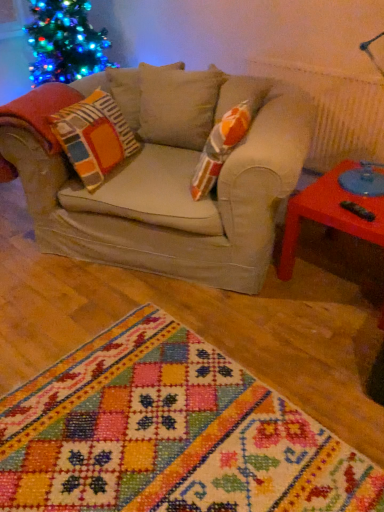
Question: Is rubberized plastic table at right in front of or behind multicolored woven rug at center in the image?

Choices:
 (A) front
 (B) behind

Answer: (B)

Question: Considering the positions of rubberized plastic table at right and multicolored woven rug at center in the image, is rubberized plastic table at right bigger or smaller than multicolored woven rug at center?

Choices:
 (A) big
 (B) small

Answer: (B)

Question: Is rubberized plastic table at right wider or thinner than multicolored woven rug at center?

Choices:
 (A) thin
 (B) wide

Answer: (A)

Question: In terms of width, does multicolored woven rug at center look wider or thinner when compared to rubberized plastic table at right?

Choices:
 (A) wide
 (B) thin

Answer: (A)

Question: Is point coord(66,413) closer or farther from the camera than point coord(382,216)?

Choices:
 (A) closer
 (B) farther

Answer: (A)

Question: In terms of height, does multicolored woven rug at center look taller or shorter compared to rubberized plastic table at right?

Choices:
 (A) short
 (B) tall

Answer: (A)

Question: Based on their positions, is multicolored woven rug at center located to the left or right of rubberized plastic table at right?

Choices:
 (A) left
 (B) right

Answer: (A)